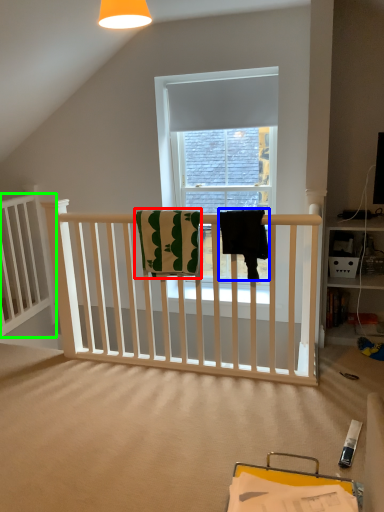
Question: Estimate the real-world distances between objects in this image. Which object is farther from beach towel (highlighted by a red box), beach towel (highlighted by a blue box) or bed frame (highlighted by a green box)?

Choices:
 (A) beach towel
 (B) bed frame

Answer: (B)